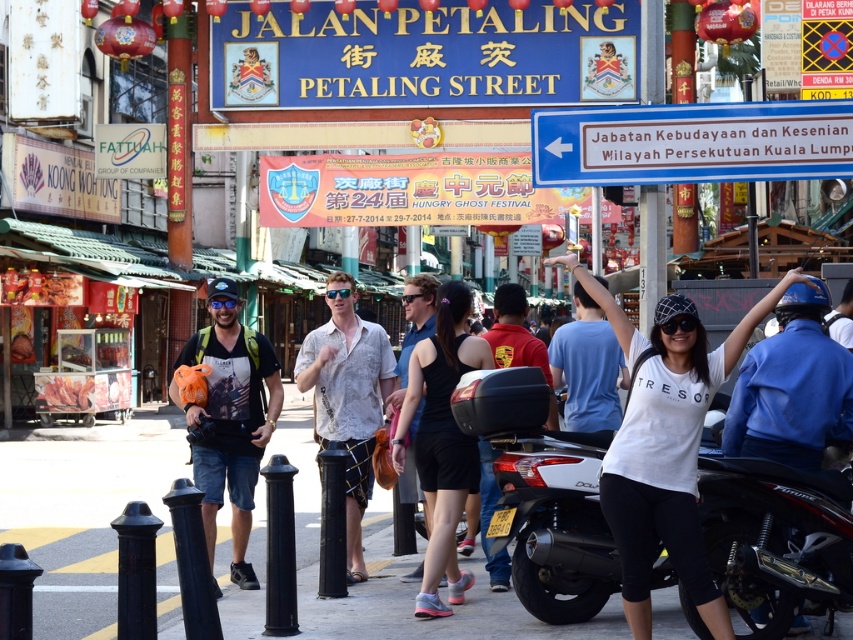
Is white cotton shirt at center behind red shirt at center?

No, it is not.

Is point (608, 296) less distant than point (503, 352)?

Yes, it is in front of point (503, 352).

Image resolution: width=853 pixels, height=640 pixels. I want to click on white cotton shirt at center, so click(665, 444).

Does gray concrete pavement at center appear on the right side of black matte tank top at center?

In fact, gray concrete pavement at center is to the left of black matte tank top at center.

Can you confirm if gray concrete pavement at center is positioned below black matte tank top at center?

Yes.

Locate an element on the screen. This screenshot has width=853, height=640. gray concrete pavement at center is located at coordinates (90, 513).

The height and width of the screenshot is (640, 853). I want to click on gray concrete pavement at center, so click(90, 513).

Does point (386, 616) come in front of point (752, 372)?

No, it is behind (752, 372).

Is point (137, 452) more distant than point (796, 416)?

Yes, point (137, 452) is behind point (796, 416).

Image resolution: width=853 pixels, height=640 pixels. I want to click on gray concrete pavement at center, so click(90, 513).